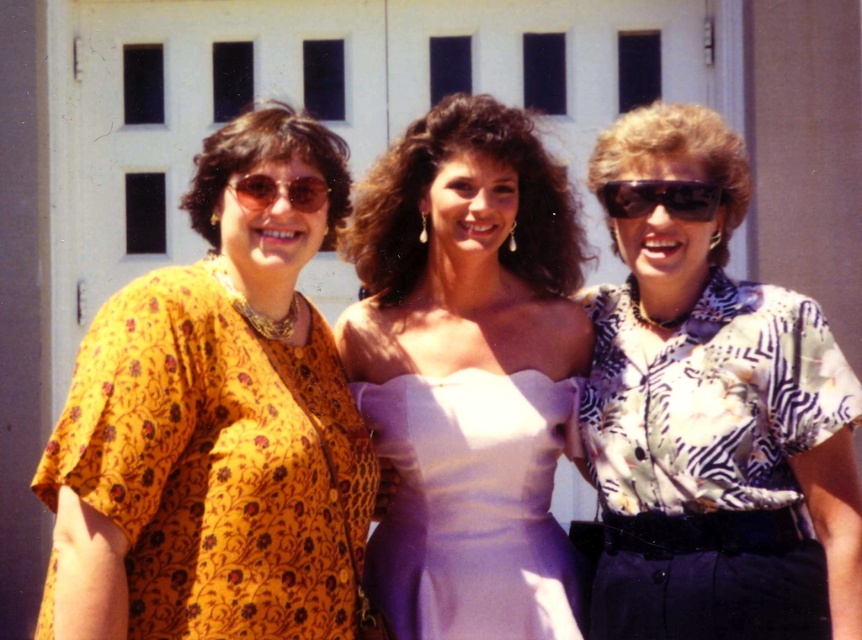
Does matte white dress at center have a smaller size compared to purple satin dress at center?

Yes.

Is point (492, 253) behind point (508, 547)?

Yes, it is.

Is point (517, 454) in front of point (513, 390)?

Yes, point (517, 454) is closer to viewer.

I want to click on matte white dress at center, so click(x=467, y=372).

Between point (236, 406) and point (669, 205), which one is positioned behind?

Point (669, 205)

Between yellow floral blouse at left and black plastic sunglasses at center, which one appears on the left side from the viewer's perspective?

From the viewer's perspective, yellow floral blouse at left appears more on the left side.

What do you see at coordinates (216, 426) in the screenshot? The image size is (862, 640). I see `yellow floral blouse at left` at bounding box center [216, 426].

Find the location of a particular element. The height and width of the screenshot is (640, 862). yellow floral blouse at left is located at coordinates (216, 426).

Who is positioned more to the left, matte white dress at center or matte plastic sunglasses at center?

From the viewer's perspective, matte plastic sunglasses at center appears more on the left side.

Is matte white dress at center positioned at the back of matte plastic sunglasses at center?

Yes, matte white dress at center is further from the viewer.

Who is more distant from viewer, (397, 179) or (242, 196)?

Point (397, 179)

Where is `matte white dress at center`? The height and width of the screenshot is (640, 862). matte white dress at center is located at coordinates (467, 372).